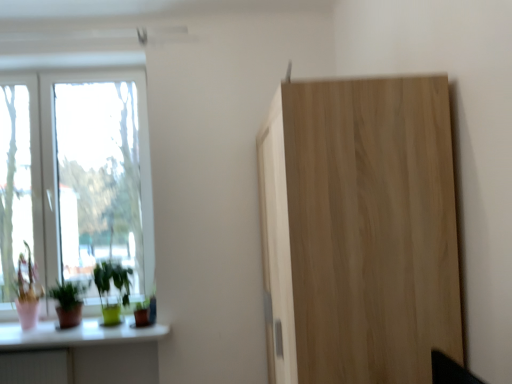
Find the location of a particular element. The height and width of the screenshot is (384, 512). blank space situated above green glossy plant at lower left, the 1th houseplant in the right-to-left sequence (from a real-world perspective) is located at coordinates (113, 254).